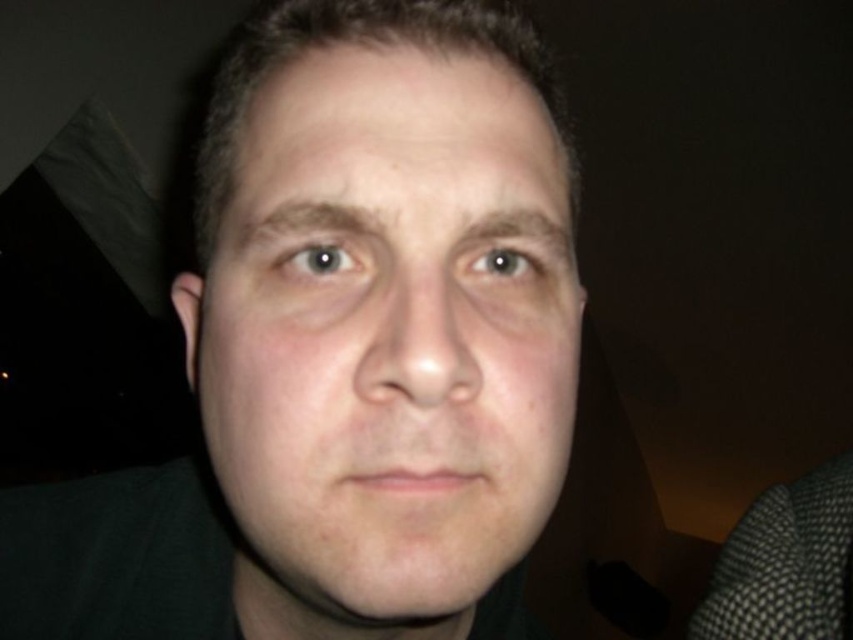
In the scene shown: Looking at the image, where is the smooth skin face at center in relation to the light brown eye at center?

The smooth skin face at center is to the left of the light brown eye at center.

You are a photographer adjusting the lighting for a portrait. You notice the blue glossy eye at upper left and the light brown eye at center in your viewfinder. Which eye should you focus on to ensure proper alignment with the lighting setup?

The light brown eye at center should be the focus point because the blue glossy eye at upper left is located below it, meaning the light brown eye at center is positioned higher and closer to the main light source.

You are a photographer adjusting the focus on a camera. You notice two eyes in the frame, the blue glossy eye at upper left and the light brown eye at center. Which eye should you focus on to ensure the subject is sharp in the photo?

You should focus on the blue glossy eye at upper left because it is in front of the light brown eye at center, making it closer to the camera and thus the primary focal point.